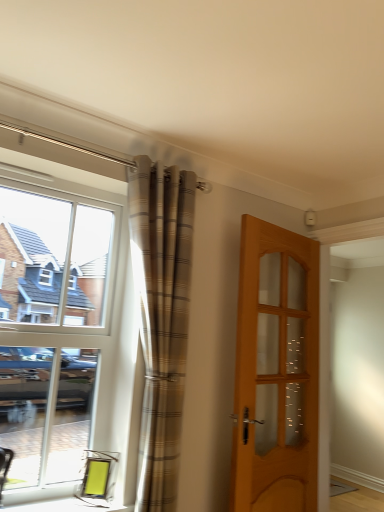
Question: Is white glass window at left completely or partially outside of plaid fabric curtain at left?

Choices:
 (A) no
 (B) yes

Answer: (B)

Question: Is white glass window at left to the left of plaid fabric curtain at left from the viewer's perspective?

Choices:
 (A) no
 (B) yes

Answer: (B)

Question: From a real-world perspective, is white glass window at left beneath plaid fabric curtain at left?

Choices:
 (A) no
 (B) yes

Answer: (B)

Question: From a real-world perspective, is white glass window at left positioned over plaid fabric curtain at left based on gravity?

Choices:
 (A) yes
 (B) no

Answer: (B)

Question: Is white glass window at left taller than plaid fabric curtain at left?

Choices:
 (A) no
 (B) yes

Answer: (A)

Question: Is matte glass window sill at lower left spatially inside plaid fabric curtain at left, or outside of it?

Choices:
 (A) inside
 (B) outside

Answer: (B)

Question: Is point (24, 489) closer or farther from the camera than point (190, 249)?

Choices:
 (A) closer
 (B) farther

Answer: (A)

Question: From a real-world perspective, is matte glass window sill at lower left above or below plaid fabric curtain at left?

Choices:
 (A) above
 (B) below

Answer: (B)

Question: From the image's perspective, is matte glass window sill at lower left located above or below plaid fabric curtain at left?

Choices:
 (A) below
 (B) above

Answer: (A)

Question: Looking at the image, does plaid fabric curtain at left seem bigger or smaller compared to matte glass window sill at lower left?

Choices:
 (A) small
 (B) big

Answer: (B)

Question: Is plaid fabric curtain at left spatially inside matte glass window sill at lower left, or outside of it?

Choices:
 (A) inside
 (B) outside

Answer: (B)

Question: From a real-world perspective, relative to matte glass window sill at lower left, is plaid fabric curtain at left vertically above or below?

Choices:
 (A) below
 (B) above

Answer: (B)

Question: Considering the positions of point (182, 194) and point (72, 498), is point (182, 194) closer or farther from the camera than point (72, 498)?

Choices:
 (A) closer
 (B) farther

Answer: (B)

Question: Considering the positions of plaid fabric curtain at left and white glass window at left in the image, is plaid fabric curtain at left taller or shorter than white glass window at left?

Choices:
 (A) short
 (B) tall

Answer: (B)

Question: Is plaid fabric curtain at left bigger or smaller than white glass window at left?

Choices:
 (A) small
 (B) big

Answer: (B)